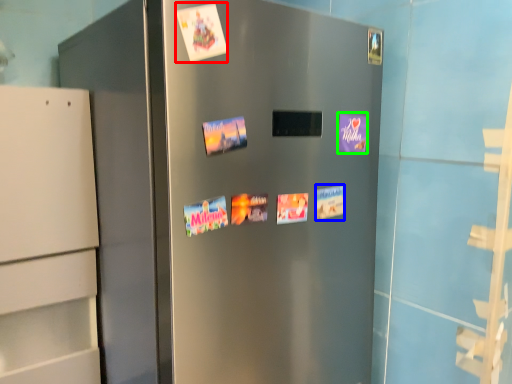
Question: Based on their relative distances, which object is farther from flyer (highlighted by a red box)? Choose from postcard (highlighted by a blue box) and postcard (highlighted by a green box).

Choices:
 (A) postcard
 (B) postcard

Answer: (A)